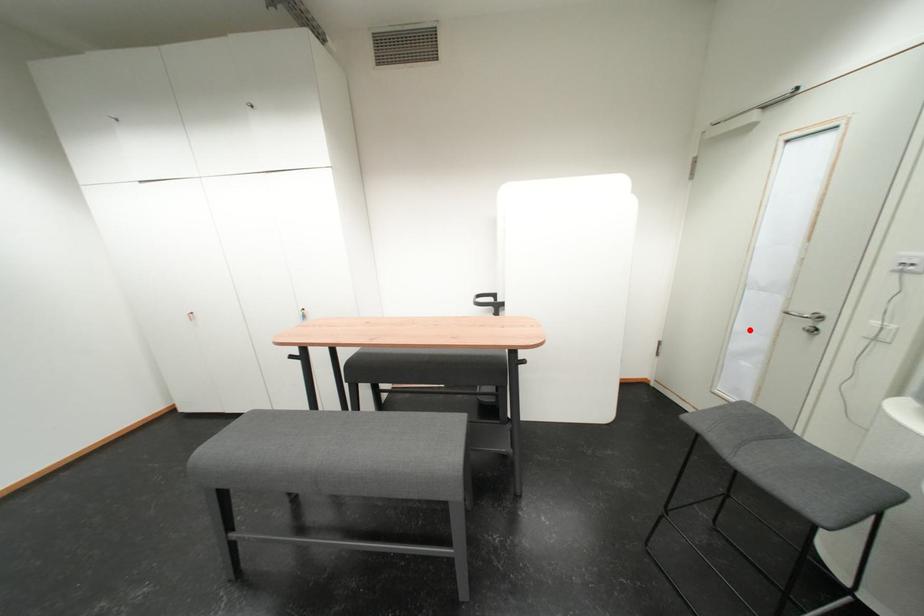
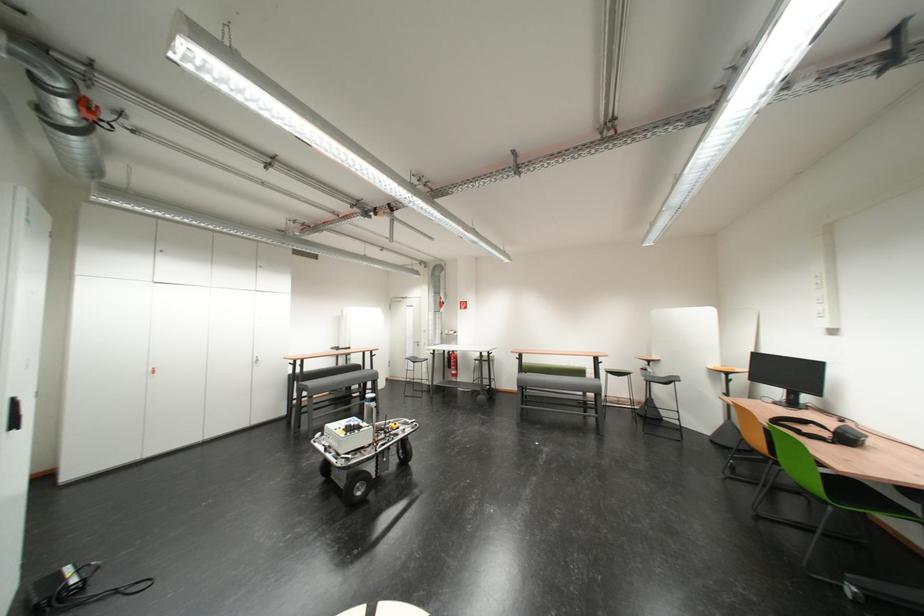
Locate, in the second image, the point that corresponds to the highlighted location in the first image.

(419, 351)